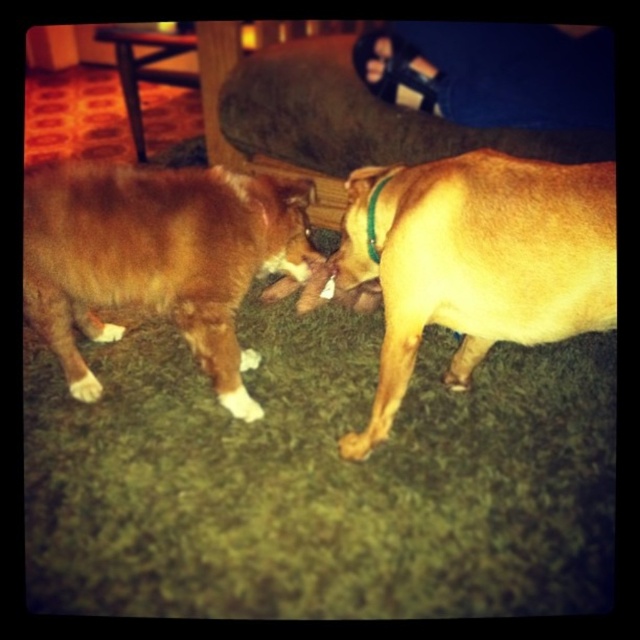
Who is positioned more to the left, brown furry dog at center or green fabric neckband at center?

Positioned to the left is brown furry dog at center.

Is brown furry dog at center below green fabric neckband at center?

Yes, brown furry dog at center is below green fabric neckband at center.

Find the location of a particular element. This screenshot has width=640, height=640. brown furry dog at center is located at coordinates (157, 257).

Is golden smooth dog at right shorter than leather sandal at upper center?

In fact, golden smooth dog at right may be taller than leather sandal at upper center.

Who is positioned more to the right, golden smooth dog at right or leather sandal at upper center?

leather sandal at upper center

The width and height of the screenshot is (640, 640). Identify the location of golden smooth dog at right. click(x=481, y=259).

Find the location of `golden smooth dog at right`. golden smooth dog at right is located at coordinates (481, 259).

Where is `brown furry dog at center`? This screenshot has height=640, width=640. brown furry dog at center is located at coordinates (157, 257).

Is point (212, 209) positioned after point (364, 440)?

Yes, it is.

This screenshot has height=640, width=640. What are the coordinates of `brown furry dog at center` in the screenshot? It's located at (157, 257).